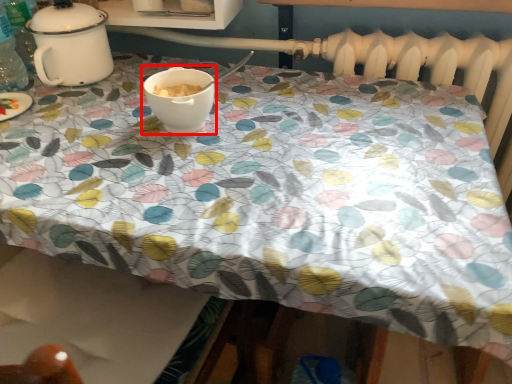
Question: Observing the image, what is the correct spatial positioning of coffee cup (annotated by the red box) in reference to tableware?

Choices:
 (A) right
 (B) left

Answer: (A)